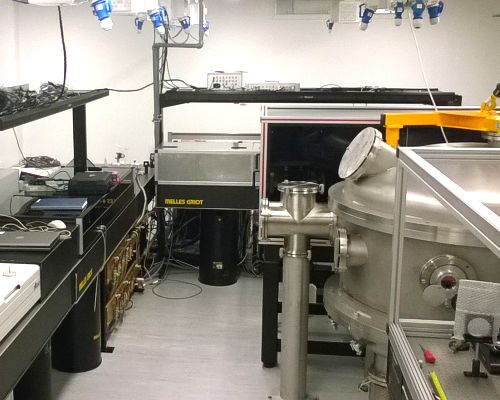
Where is `cords`? cords is located at coordinates (66, 64), (115, 89), (161, 275).